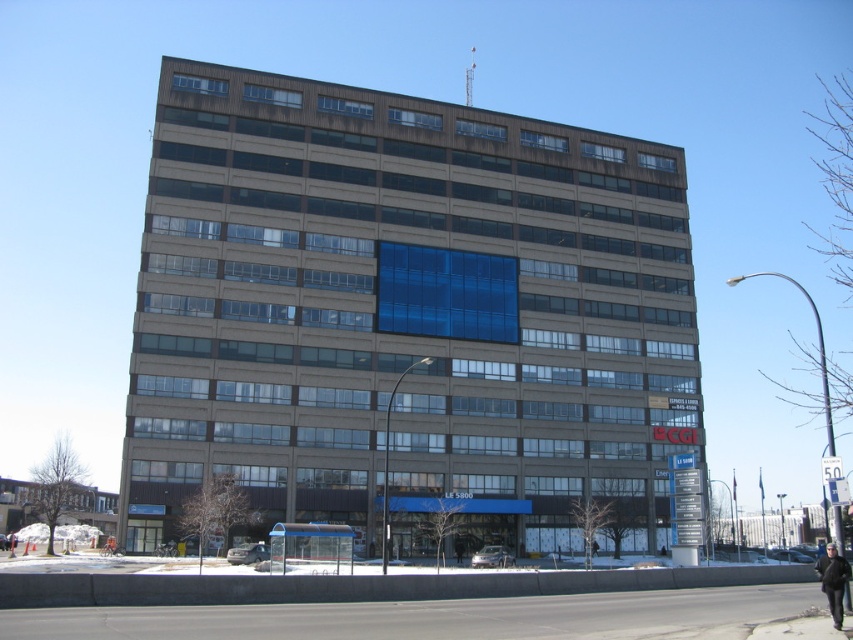
Does black leather jacket at lower right have a smaller size compared to black leather jacket at lower left?

Actually, black leather jacket at lower right might be larger than black leather jacket at lower left.

Does black leather jacket at lower right appear under black leather jacket at lower left?

No.

Describe the element at coordinates (833, 580) in the screenshot. The image size is (853, 640). I see `black leather jacket at lower right` at that location.

Where is `black leather jacket at lower right`? black leather jacket at lower right is located at coordinates (833, 580).